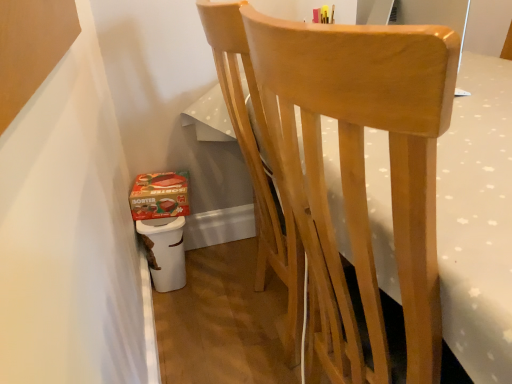
Question: From the image's perspective, does white plastic potty at lower left appear higher than matte cardboard box at lower left?

Choices:
 (A) yes
 (B) no

Answer: (B)

Question: Does white plastic potty at lower left have a larger size compared to matte cardboard box at lower left?

Choices:
 (A) no
 (B) yes

Answer: (B)

Question: Can matte cardboard box at lower left be found inside white plastic potty at lower left?

Choices:
 (A) yes
 (B) no

Answer: (B)

Question: From the image's perspective, is white plastic potty at lower left under matte cardboard box at lower left?

Choices:
 (A) no
 (B) yes

Answer: (B)

Question: Is white plastic potty at lower left closer to camera compared to matte cardboard box at lower left?

Choices:
 (A) no
 (B) yes

Answer: (B)

Question: Considering the positions of natural wood chair at center and matte cardboard box at lower left in the image, is natural wood chair at center bigger or smaller than matte cardboard box at lower left?

Choices:
 (A) big
 (B) small

Answer: (A)

Question: From a real-world perspective, is natural wood chair at center physically located above or below matte cardboard box at lower left?

Choices:
 (A) above
 (B) below

Answer: (A)

Question: Is natural wood chair at center spatially inside matte cardboard box at lower left, or outside of it?

Choices:
 (A) inside
 (B) outside

Answer: (B)

Question: Does point (362, 29) appear closer or farther from the camera than point (147, 195)?

Choices:
 (A) closer
 (B) farther

Answer: (A)

Question: In the image, is matte cardboard box at lower left positioned in front of or behind white plastic potty at lower left?

Choices:
 (A) behind
 (B) front

Answer: (A)

Question: From a real-world perspective, is matte cardboard box at lower left above or below white plastic potty at lower left?

Choices:
 (A) above
 (B) below

Answer: (A)

Question: Choose the correct answer: Is matte cardboard box at lower left inside white plastic potty at lower left or outside it?

Choices:
 (A) outside
 (B) inside

Answer: (A)

Question: In terms of size, does matte cardboard box at lower left appear bigger or smaller than white plastic potty at lower left?

Choices:
 (A) small
 (B) big

Answer: (A)

Question: From a real-world perspective, relative to matte cardboard box at lower left, is white plastic potty at lower left vertically above or below?

Choices:
 (A) above
 (B) below

Answer: (B)

Question: In terms of height, does white plastic potty at lower left look taller or shorter compared to matte cardboard box at lower left?

Choices:
 (A) short
 (B) tall

Answer: (B)